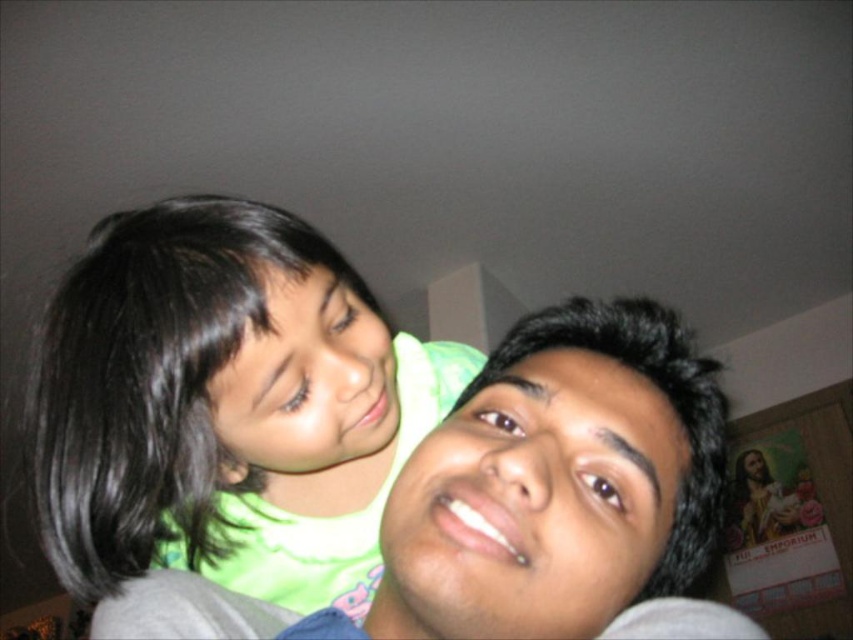
Is green matte shirt at upper left wider than matte gray shirt at center?

No.

How distant is green matte shirt at upper left from matte gray shirt at center?

green matte shirt at upper left and matte gray shirt at center are 10.78 centimeters apart.

Does point (322, 444) come behind point (643, 460)?

Yes, point (322, 444) is behind point (643, 460).

This screenshot has width=853, height=640. In order to click on green matte shirt at upper left in this screenshot , I will do `click(225, 406)`.